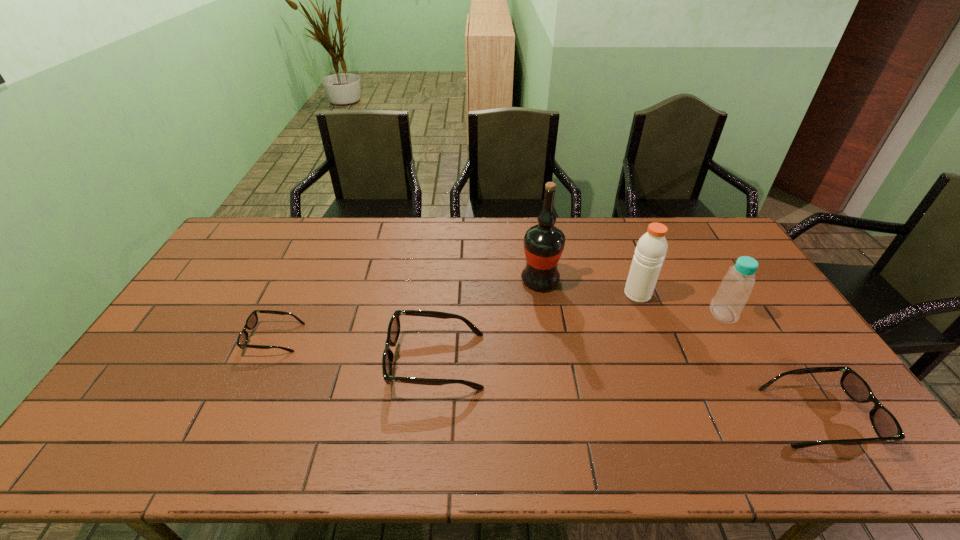
Locate an element on the screen. This screenshot has width=960, height=540. the shortest object is located at coordinates (252, 320).

The image size is (960, 540). In order to click on the leftmost spectacles in this screenshot , I will do `click(252, 320)`.

Find the location of a particular element. The height and width of the screenshot is (540, 960). the second spectacles from right to left is located at coordinates click(x=393, y=332).

The height and width of the screenshot is (540, 960). In order to click on the second shortest spectacles in this screenshot , I will do `click(884, 423)`.

You are a GUI agent. You are given a task and a screenshot of the screen. Output one action in this format:
    pyautogui.click(x=<x>, y=<y>)
    Task: Click on the rightmost spectacles
    The width and height of the screenshot is (960, 540).
    Given the screenshot: What is the action you would take?
    pyautogui.click(x=884, y=423)

You are a GUI agent. You are given a task and a screenshot of the screen. Output one action in this format:
    pyautogui.click(x=<x>, y=<y>)
    Task: Click on the wine bottle
    The width and height of the screenshot is (960, 540).
    Given the screenshot: What is the action you would take?
    pyautogui.click(x=544, y=243)

Find the location of a particular element. the fourth object from right to left is located at coordinates (544, 243).

Identify the location of shaker. click(651, 249).

Where is `the fifth shortest object`? the fifth shortest object is located at coordinates (651, 249).

Locate an element on the screen. The width and height of the screenshot is (960, 540). bottle is located at coordinates (735, 288).